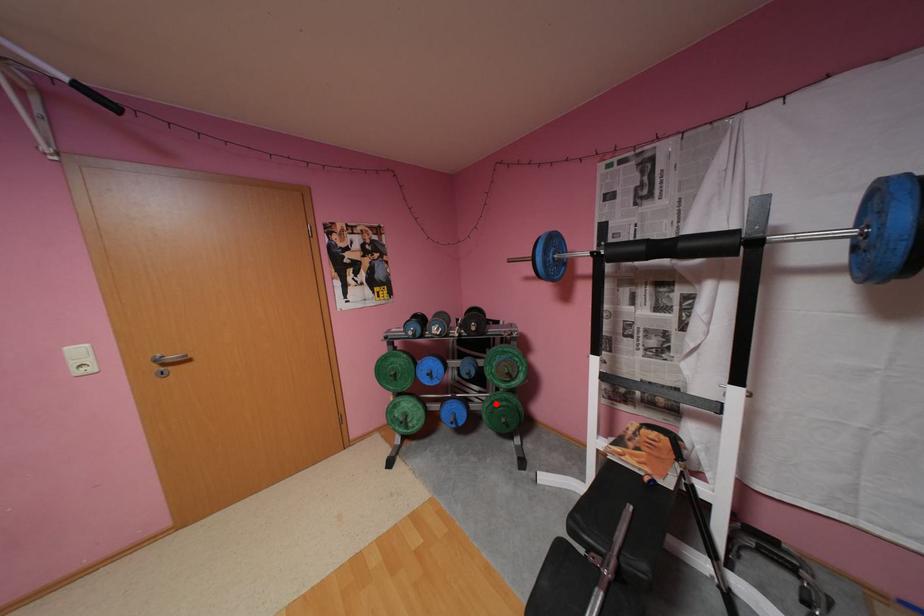
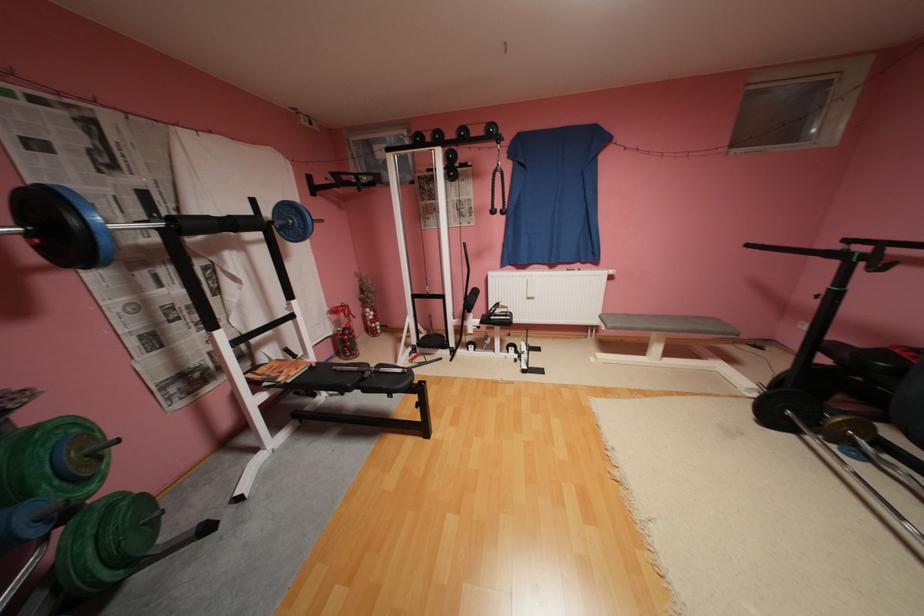
Question: I am providing you with two images of the same scene from different viewpoints. A red point is shown in image1. For the corresponding object point in image2, is it positioned nearer or farther from the camera?

Choices:
 (A) Nearer
 (B) Farther

Answer: (B)